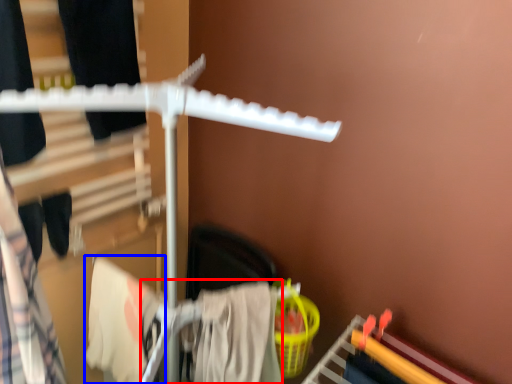
Question: Among these objects, which one is farthest to the camera, clothing (highlighted by a red box) or clothing (highlighted by a blue box)?

Choices:
 (A) clothing
 (B) clothing

Answer: (B)